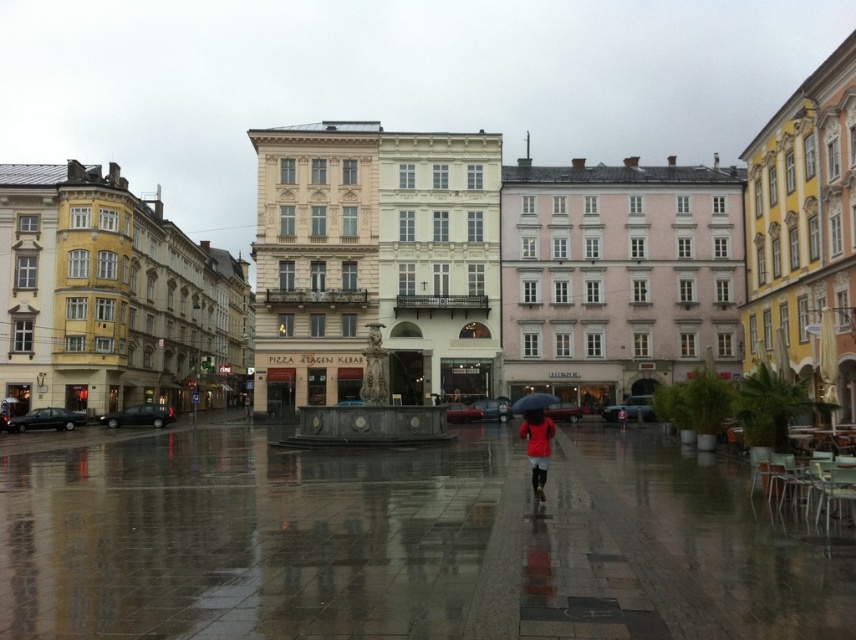
Question: Which object is closer to the camera taking this photo?

Choices:
 (A) blue matte umbrella at center
 (B) red matte coat at center

Answer: (B)

Question: Does red matte coat at center have a lesser width compared to blue matte umbrella at center?

Choices:
 (A) yes
 (B) no

Answer: (A)

Question: Which object is farther from the camera taking this photo?

Choices:
 (A) red matte coat at center
 (B) blue matte umbrella at center

Answer: (B)

Question: Which object is closer to the camera taking this photo?

Choices:
 (A) blue matte umbrella at center
 (B) red matte coat at center

Answer: (B)

Question: Can you confirm if red matte coat at center is positioned below blue matte umbrella at center?

Choices:
 (A) no
 (B) yes

Answer: (B)

Question: Does red matte coat at center have a lesser width compared to blue matte umbrella at center?

Choices:
 (A) no
 (B) yes

Answer: (B)